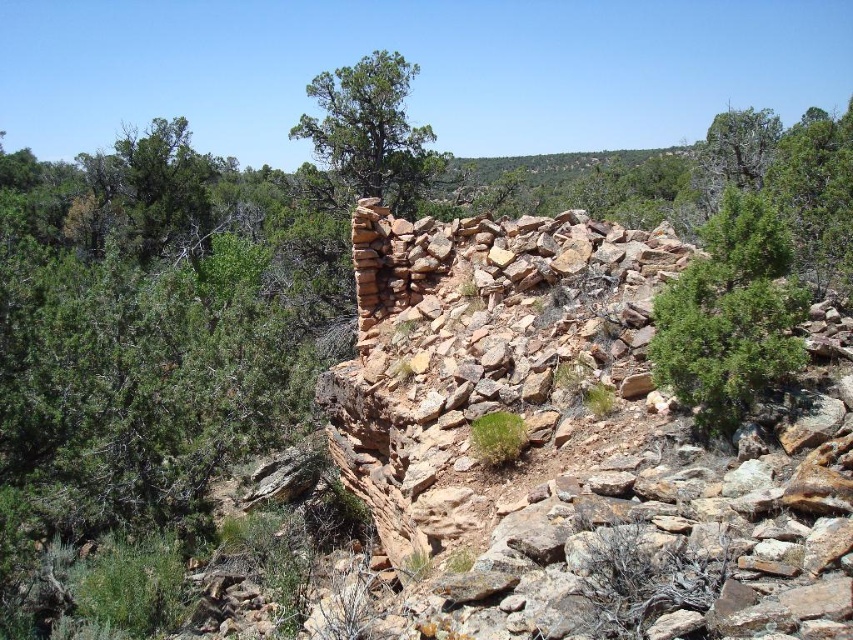
You are an explorer in this rocky landscape and need to locate the highest point to get a better view. Which tree should you climb, the green textured tree at upper center or the green leafy tree at upper right?

The green textured tree at upper center is above the green leafy tree at upper right, so you should climb the green textured tree at upper center to reach a higher vantage point.